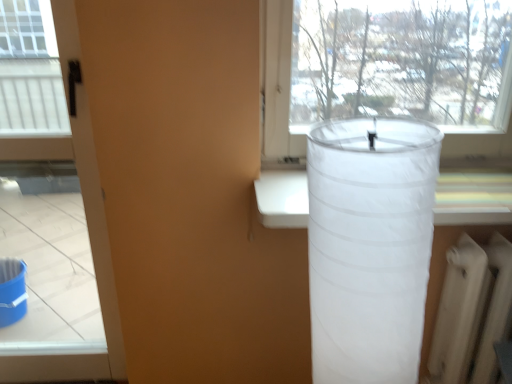
The height and width of the screenshot is (384, 512). Describe the element at coordinates (472, 312) in the screenshot. I see `white matte radiator at lower right` at that location.

Measure the distance between white matte radiator at lower right and camera.

A distance of 3.87 feet exists between white matte radiator at lower right and camera.

Image resolution: width=512 pixels, height=384 pixels. Find the location of `white matte radiator at lower right`. white matte radiator at lower right is located at coordinates (472, 312).

Is the position of matte black screen door at left less distant than that of white matte radiator at lower right?

That is True.

Is matte black screen door at left aimed at white matte radiator at lower right?

No, matte black screen door at left is not aimed at white matte radiator at lower right.

In terms of width, does matte black screen door at left look wider or thinner when compared to white matte radiator at lower right?

Clearly, matte black screen door at left has less width compared to white matte radiator at lower right.

Who is taller, matte black screen door at left or white matte radiator at lower right?

Standing taller between the two is matte black screen door at left.

Considering the positions of objects matte black screen door at left and transparent fabric lampshade at right in the image provided, who is more to the left, matte black screen door at left or transparent fabric lampshade at right?

matte black screen door at left.

Considering the sizes of objects matte black screen door at left and transparent fabric lampshade at right in the image provided, who is wider, matte black screen door at left or transparent fabric lampshade at right?

transparent fabric lampshade at right.

How many degrees apart are the facing directions of matte black screen door at left and transparent fabric lampshade at right?

The facing directions of matte black screen door at left and transparent fabric lampshade at right are 0.0011 degrees apart.

Based on their sizes in the image, would you say matte black screen door at left is bigger or smaller than transparent fabric lampshade at right?

Considering their sizes, matte black screen door at left takes up more space than transparent fabric lampshade at right.

Is white matte radiator at lower right facing away from transparent fabric lampshade at right?

No, white matte radiator at lower right is not facing away from transparent fabric lampshade at right.

Is white matte radiator at lower right bigger than transparent fabric lampshade at right?

Incorrect, white matte radiator at lower right is not larger than transparent fabric lampshade at right.

Are white matte radiator at lower right and transparent fabric lampshade at right located far from each other?

No.

Which object is further away from the camera taking this photo, white matte radiator at lower right or transparent fabric lampshade at right?

Positioned behind is white matte radiator at lower right.

Considering the positions of objects transparent fabric lampshade at right and matte black screen door at left in the image provided, who is more to the right, transparent fabric lampshade at right or matte black screen door at left?

transparent fabric lampshade at right.

Which of these two, transparent fabric lampshade at right or matte black screen door at left, is wider?

Wider between the two is transparent fabric lampshade at right.

How different are the orientations of transparent fabric lampshade at right and matte black screen door at left in degrees?

transparent fabric lampshade at right and matte black screen door at left are facing 0.0011 degrees away from each other.

Considering the sizes of transparent fabric lampshade at right and matte black screen door at left in the image, is transparent fabric lampshade at right taller or shorter than matte black screen door at left?

Clearly, transparent fabric lampshade at right is shorter compared to matte black screen door at left.

In the scene shown: Is transparent fabric lampshade at right outside of white matte radiator at lower right?

Absolutely, transparent fabric lampshade at right is external to white matte radiator at lower right.

Between transparent fabric lampshade at right and white matte radiator at lower right, which one appears on the right side from the viewer's perspective?

white matte radiator at lower right.

What are the coordinates of `radiator beneath the transparent fabric lampshade at right (from a real-world perspective)` in the screenshot? It's located at (472, 312).

Who is smaller, transparent fabric lampshade at right or white matte radiator at lower right?

With smaller size is white matte radiator at lower right.

Considering their positions, is white matte radiator at lower right located in front of or behind matte black screen door at left?

In the image, white matte radiator at lower right appears behind matte black screen door at left.

Is white matte radiator at lower right spatially inside matte black screen door at left, or outside of it?

The correct answer is: outside.

From a real-world perspective, which is physically above, white matte radiator at lower right or matte black screen door at left?

matte black screen door at left.

At what (x,y) coordinates should I click in order to perform the action: click on screen door on the left of white matte radiator at lower right. Please return your answer as a coordinate pair (x, y). This screenshot has height=384, width=512. Looking at the image, I should click on coord(89,179).

You are a GUI agent. You are given a task and a screenshot of the screen. Output one action in this format:
    pyautogui.click(x=<x>, y=<y>)
    Task: Click on the screen door above the white matte radiator at lower right (from a real-world perspective)
    
    Given the screenshot: What is the action you would take?
    pyautogui.click(x=89, y=179)

You are a GUI agent. You are given a task and a screenshot of the screen. Output one action in this format:
    pyautogui.click(x=<x>, y=<y>)
    Task: Click on the screen door below the transparent fabric lampshade at right (from a real-world perspective)
    Image resolution: width=512 pixels, height=384 pixels.
    Given the screenshot: What is the action you would take?
    pyautogui.click(x=89, y=179)

Estimate the real-world distances between objects in this image. Which object is further from matte black screen door at left, transparent fabric lampshade at right or white matte radiator at lower right?

white matte radiator at lower right lies further to matte black screen door at left than the other object.

Considering their positions, is matte black screen door at left positioned further to white matte radiator at lower right than transparent fabric lampshade at right?

matte black screen door at left lies further to white matte radiator at lower right than the other object.

Considering their positions, is matte black screen door at left positioned further to transparent fabric lampshade at right than white matte radiator at lower right?

Based on the image, matte black screen door at left appears to be further to transparent fabric lampshade at right.

Estimate the real-world distances between objects in this image. Which object is closer to transparent fabric lampshade at right, white matte radiator at lower right or matte black screen door at left?

white matte radiator at lower right is positioned closer to the anchor transparent fabric lampshade at right.

From the image, which object appears to be nearer to white matte radiator at lower right, transparent fabric lampshade at right or matte black screen door at left?

Among the two, transparent fabric lampshade at right is located nearer to white matte radiator at lower right.

Based on their spatial positions, is white matte radiator at lower right or transparent fabric lampshade at right closer to matte black screen door at left?

Among the two, transparent fabric lampshade at right is located nearer to matte black screen door at left.

Locate an element on the screen. lamp between matte black screen door at left and white matte radiator at lower right in the horizontal direction is located at coordinates (370, 246).